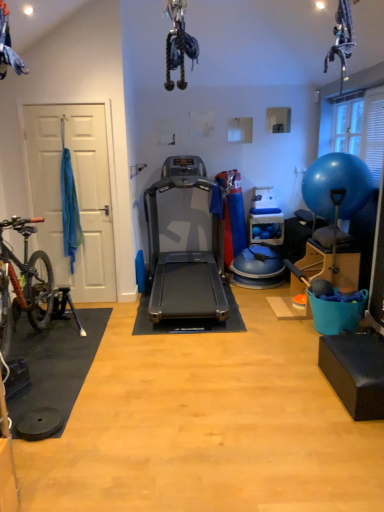
The height and width of the screenshot is (512, 384). In order to click on silver metallic treadmill at center in this screenshot , I will do `click(183, 255)`.

Identify the location of blue rubber ball at right. (337, 186).

In order to face transparent plastic window screen at upper right, should I rotate leftwards or rightwards?

Rotate right and turn 20.594 degrees.

The image size is (384, 512). Identify the location of silver metallic treadmill at center. (183, 255).

Is the depth of transparent plastic window screen at upper right greater than that of blue rubber ball at right?

Yes, transparent plastic window screen at upper right is further from the viewer.

Is blue rubber ball at right surrounded by transparent plastic window screen at upper right?

No, blue rubber ball at right is located outside of transparent plastic window screen at upper right.

Where is `ball below the transparent plastic window screen at upper right (from a real-world perspective)`? ball below the transparent plastic window screen at upper right (from a real-world perspective) is located at coordinates (337, 186).

From a real-world perspective, which object stands above the other?

In real-world perspective, transparent plastic window screen at upper right is above.

Is transparent plastic window screen at upper right further to the viewer compared to silver metallic treadmill at center?

Yes, transparent plastic window screen at upper right is behind silver metallic treadmill at center.

Considering the relative sizes of transparent plastic window screen at upper right and silver metallic treadmill at center in the image provided, is transparent plastic window screen at upper right smaller than silver metallic treadmill at center?

Correct, transparent plastic window screen at upper right occupies less space than silver metallic treadmill at center.

Between blue rubber ball at right and silver metallic treadmill at center, which one appears on the left side from the viewer's perspective?

silver metallic treadmill at center is more to the left.

Considering the relative sizes of blue rubber ball at right and silver metallic treadmill at center in the image provided, is blue rubber ball at right bigger than silver metallic treadmill at center?

Actually, blue rubber ball at right might be smaller than silver metallic treadmill at center.

Can we say blue rubber ball at right lies outside silver metallic treadmill at center?

Yes.

Is blue rubber ball at right far away from silver metallic treadmill at center?

Yes, blue rubber ball at right is far from silver metallic treadmill at center.

There is a blue rubber ball at right. Where is `window screen above it (from a real-world perspective)`? window screen above it (from a real-world perspective) is located at coordinates (361, 128).

How many degrees apart are the facing directions of blue rubber ball at right and transparent plastic window screen at upper right?

blue rubber ball at right and transparent plastic window screen at upper right are facing 0.526 degrees away from each other.

From a real-world perspective, which is physically below, blue rubber ball at right or transparent plastic window screen at upper right?

blue rubber ball at right, from a real-world perspective.

Who is taller, blue rubber ball at right or transparent plastic window screen at upper right?

blue rubber ball at right.

Based on the photo, can you tell me how much silver metallic treadmill at center and transparent plastic window screen at upper right differ in facing direction?

90 degrees separate the facing orientations of silver metallic treadmill at center and transparent plastic window screen at upper right.

Is silver metallic treadmill at center oriented away from transparent plastic window screen at upper right?

That's not correct — silver metallic treadmill at center is not looking away from transparent plastic window screen at upper right.

Is silver metallic treadmill at center not near transparent plastic window screen at upper right?

silver metallic treadmill at center is far away from transparent plastic window screen at upper right.

From their relative heights in the image, would you say silver metallic treadmill at center is taller or shorter than transparent plastic window screen at upper right?

In the image, silver metallic treadmill at center appears to be taller than transparent plastic window screen at upper right.

From the image's perspective, is silver metallic treadmill at center located above blue rubber ball at right?

No.

Identify the location of ball above the silver metallic treadmill at center (from the image's perspective). (337, 186).

Does silver metallic treadmill at center have a smaller size compared to blue rubber ball at right?

Incorrect, silver metallic treadmill at center is not smaller in size than blue rubber ball at right.

Are silver metallic treadmill at center and blue rubber ball at right located far from each other?

Yes, silver metallic treadmill at center is far from blue rubber ball at right.

The height and width of the screenshot is (512, 384). What are the coordinates of `window screen behind the blue rubber ball at right` in the screenshot? It's located at (361, 128).

This screenshot has height=512, width=384. I want to click on treadmill below the transparent plastic window screen at upper right (from a real-world perspective), so click(183, 255).

Which object lies further to the anchor point silver metallic treadmill at center, blue rubber ball at right or transparent plastic window screen at upper right?

Based on the image, transparent plastic window screen at upper right appears to be further to silver metallic treadmill at center.

Looking at the image, which one is located further to transparent plastic window screen at upper right, silver metallic treadmill at center or blue rubber ball at right?

silver metallic treadmill at center is positioned further to the anchor transparent plastic window screen at upper right.

Which object lies further to the anchor point transparent plastic window screen at upper right, blue rubber ball at right or silver metallic treadmill at center?

silver metallic treadmill at center is positioned further to the anchor transparent plastic window screen at upper right.

Considering their positions, is transparent plastic window screen at upper right positioned further to silver metallic treadmill at center than blue rubber ball at right?

transparent plastic window screen at upper right lies further to silver metallic treadmill at center than the other object.

Based on their spatial positions, is transparent plastic window screen at upper right or silver metallic treadmill at center closer to blue rubber ball at right?

Among the two, transparent plastic window screen at upper right is located nearer to blue rubber ball at right.

From the image, which object appears to be farther from blue rubber ball at right, silver metallic treadmill at center or transparent plastic window screen at upper right?

silver metallic treadmill at center is further to blue rubber ball at right.

You are a GUI agent. You are given a task and a screenshot of the screen. Output one action in this format:
    pyautogui.click(x=<x>, y=<y>)
    Task: Click on the ball located between silver metallic treadmill at center and transparent plastic window screen at upper right in the left-right direction
    This screenshot has width=384, height=512.
    Given the screenshot: What is the action you would take?
    pyautogui.click(x=337, y=186)